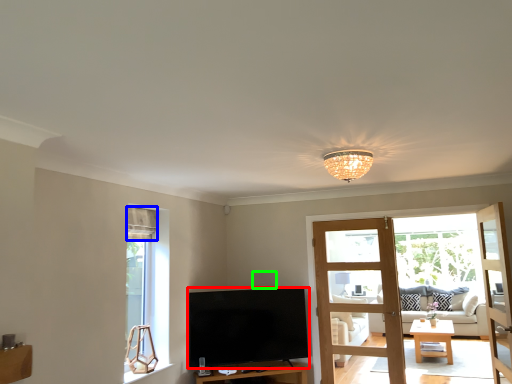
Question: Considering the real-world distances, which object is closest to television (highlighted by a red box)? curtain (highlighted by a blue box) or loudspeaker (highlighted by a green box).

Choices:
 (A) curtain
 (B) loudspeaker

Answer: (B)